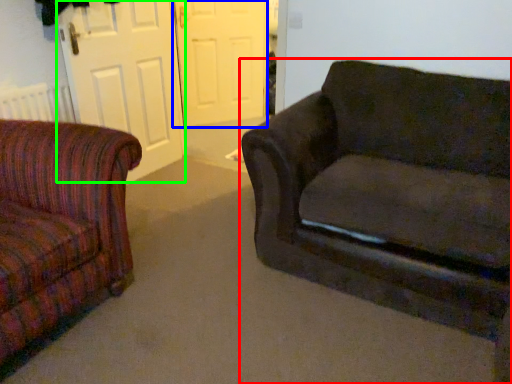
Question: Estimate the real-world distances between objects in this image. Which object is farther from studio couch (highlighted by a red box), screen door (highlighted by a blue box) or screen door (highlighted by a green box)?

Choices:
 (A) screen door
 (B) screen door

Answer: (A)